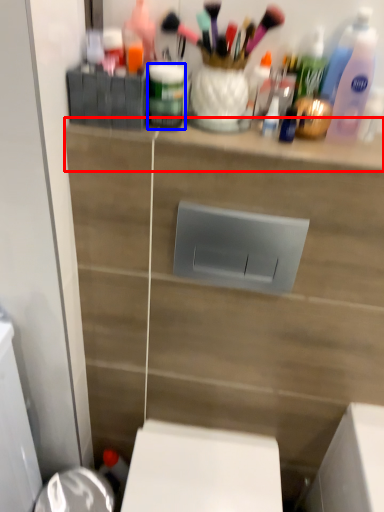
Question: Which of the following is the closest to the observer, ledge (highlighted by a red box) or toiletry (highlighted by a blue box)?

Choices:
 (A) ledge
 (B) toiletry

Answer: (A)